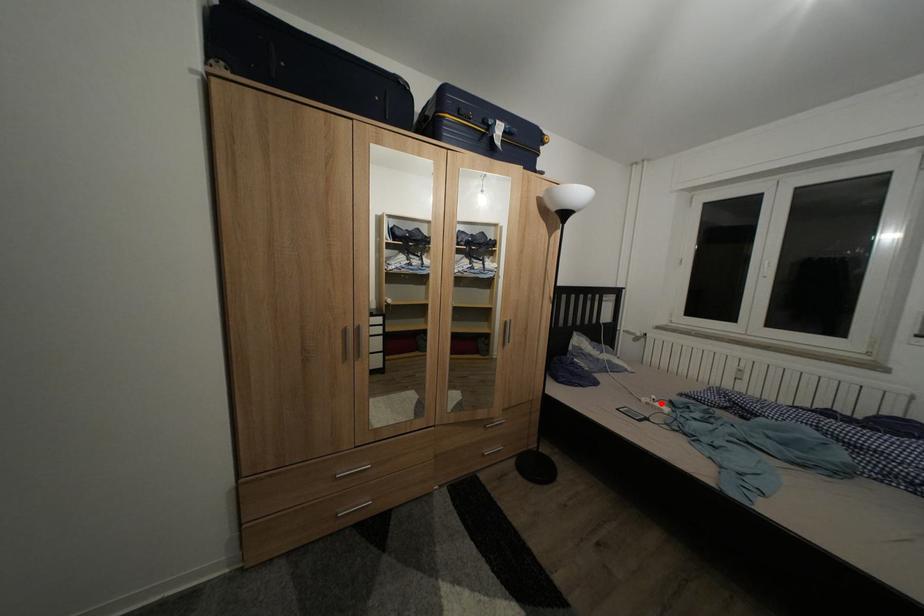
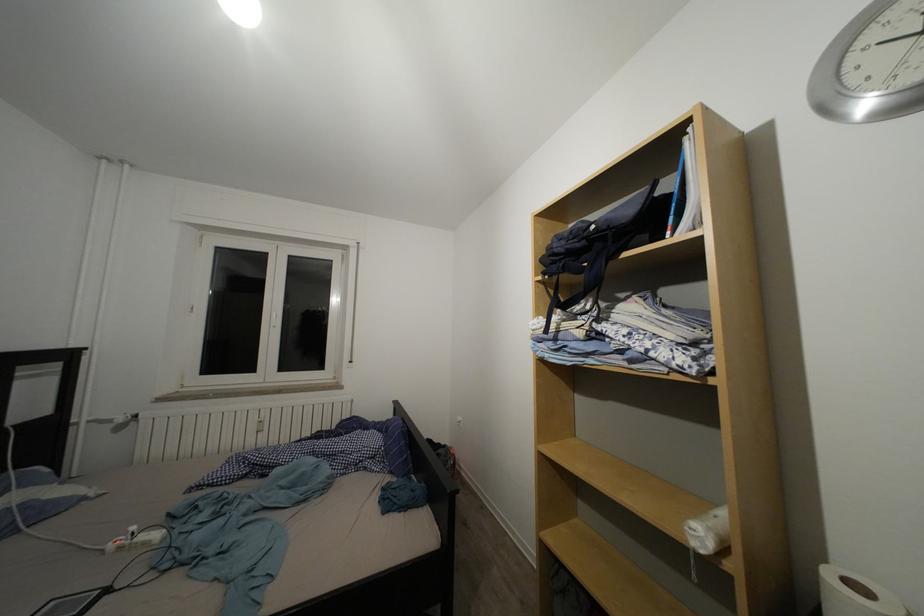
Locate, in the second image, the point that corresponds to the highlighted location in the first image.

(140, 533)